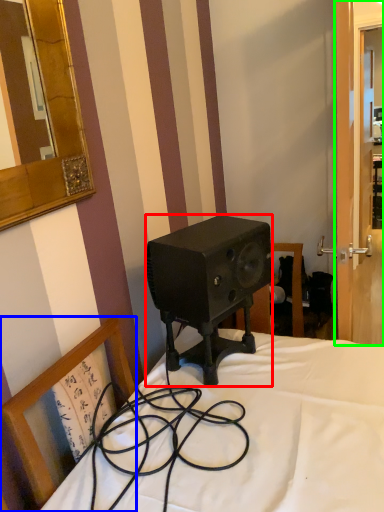
Question: Which object is the farthest from speaker (highlighted by a red box)? Choose among these: chair (highlighted by a blue box) or screen door (highlighted by a green box).

Choices:
 (A) chair
 (B) screen door

Answer: (B)